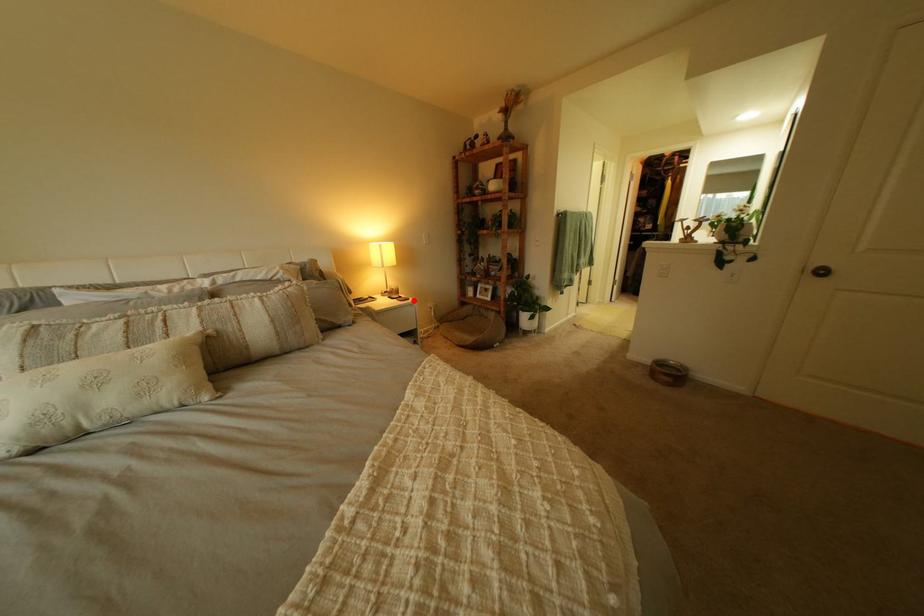
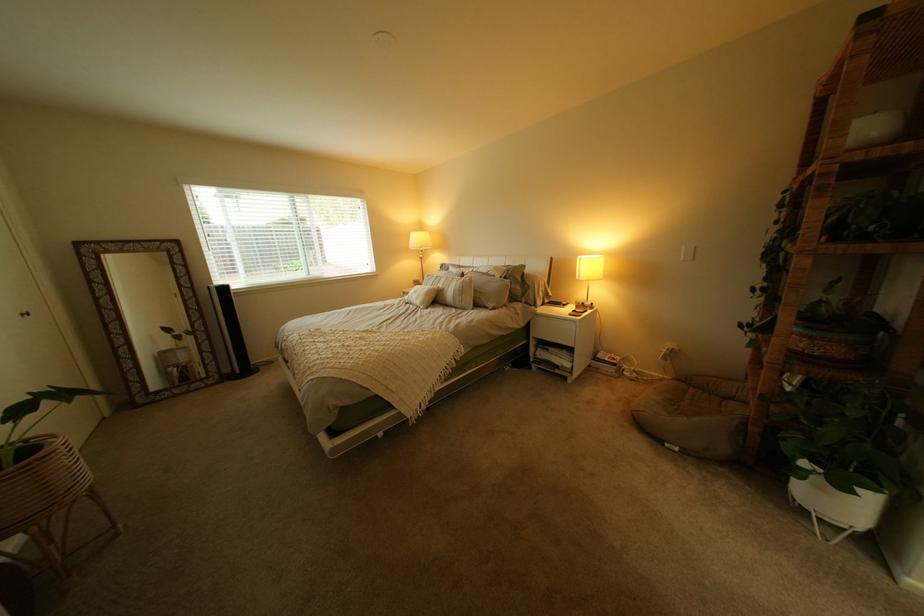
Question: I am providing you with two images of the same scene from different viewpoints. Image1 has a red point marked. In image2, the corresponding 3D location appears at what relative position? Reply with the corresponding letter.

Choices:
 (A) Closer
 (B) Farther

Answer: (B)